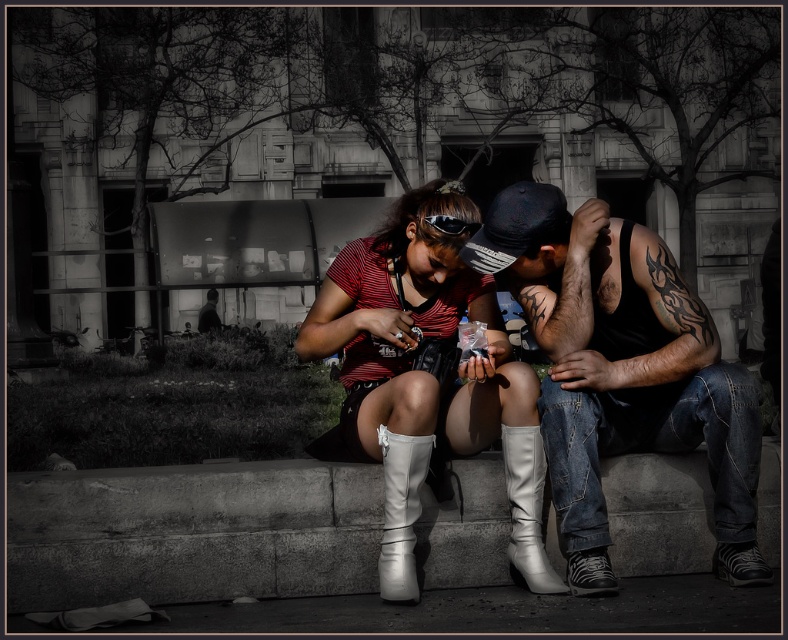
Question: Can you confirm if dark denim jeans at center is positioned to the right of white leather boot at lower center?

Choices:
 (A) no
 (B) yes

Answer: (B)

Question: Which object is the closest to the white leather boot at lower center?

Choices:
 (A) dark denim jeans at center
 (B) black fabric baseball cap at center
 (C) white leather boot at center
 (D) black matte goggles at center

Answer: (A)

Question: Which of the following is the farthest from the observer?

Choices:
 (A) black matte goggles at center
 (B) dark denim jeans at center
 (C) black fabric baseball cap at center
 (D) white leather boot at lower center

Answer: (C)

Question: From the image, what is the correct spatial relationship of white leather boots at center in relation to black fabric baseball cap at center?

Choices:
 (A) left
 (B) right

Answer: (A)

Question: Among these points, which one is farthest from the camera?

Choices:
 (A) (396, 486)
 (B) (470, 225)

Answer: (B)

Question: Does white leather boots at center come behind black matte goggles at center?

Choices:
 (A) yes
 (B) no

Answer: (B)